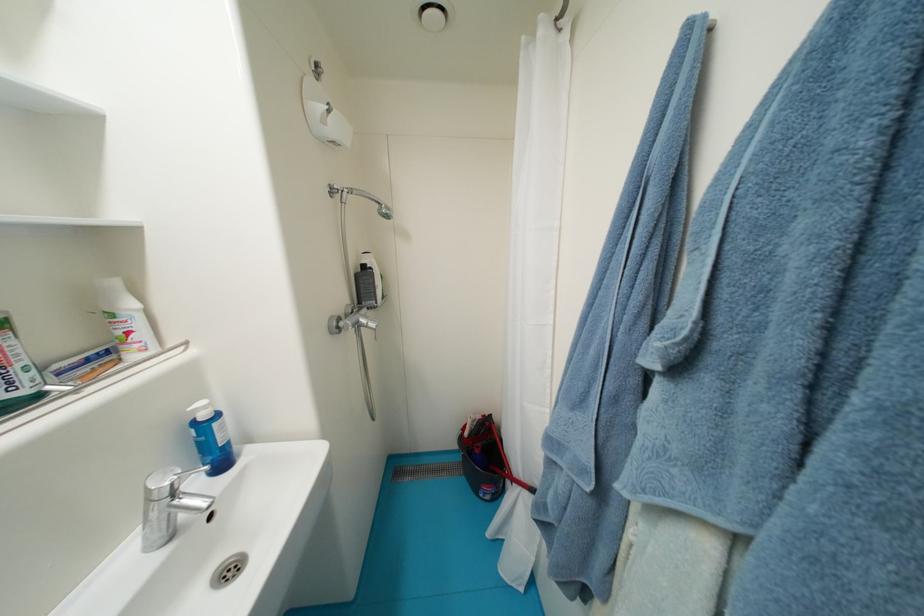
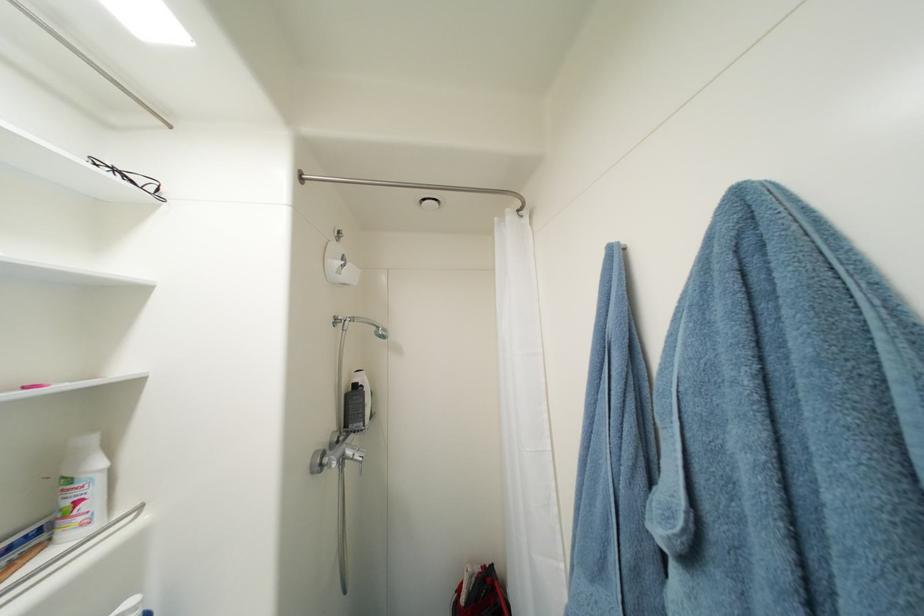
Find the pixel in the second image that matches point 370,323 in the first image.

(356, 454)